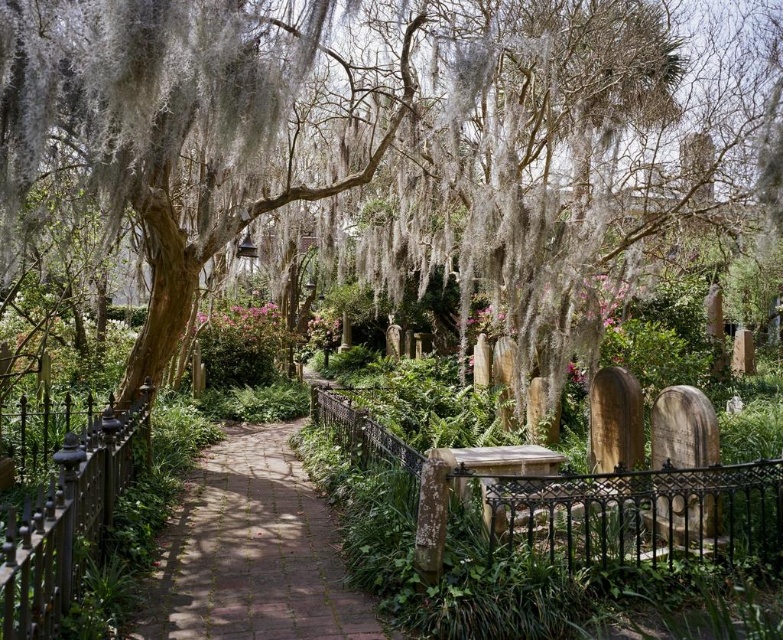
Question: Is green mossy tree at center below black wrought iron fence at left?

Choices:
 (A) no
 (B) yes

Answer: (A)

Question: Is green mossy tree at center further to camera compared to black wrought iron fence at left?

Choices:
 (A) yes
 (B) no

Answer: (A)

Question: Which object is the farthest from the brick paved path at center?

Choices:
 (A) black wrought iron fence at left
 (B) black wrought iron fence at center
 (C) green mossy tree at center

Answer: (C)

Question: Does brick paved path at center have a larger size compared to black wrought iron fence at left?

Choices:
 (A) no
 (B) yes

Answer: (A)

Question: Which point is closer to the camera?

Choices:
 (A) brick paved path at center
 (B) green mossy tree at center
 (C) black wrought iron fence at center
 (D) black wrought iron fence at left

Answer: (D)

Question: Which object appears farthest from the camera in this image?

Choices:
 (A) brick paved path at center
 (B) black wrought iron fence at center
 (C) green mossy tree at center
 (D) black wrought iron fence at left

Answer: (B)